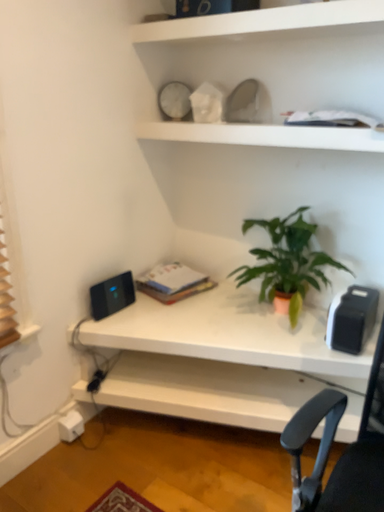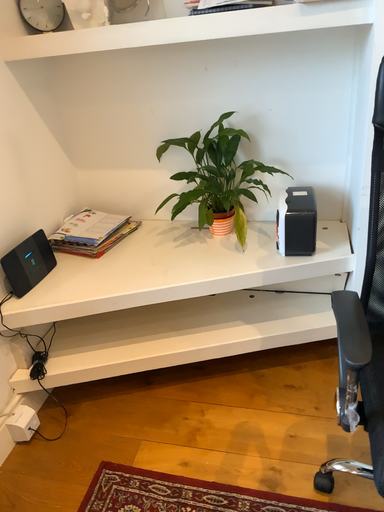
Question: Which way did the camera rotate in the video?

Choices:
 (A) rotated left
 (B) rotated right

Answer: (B)